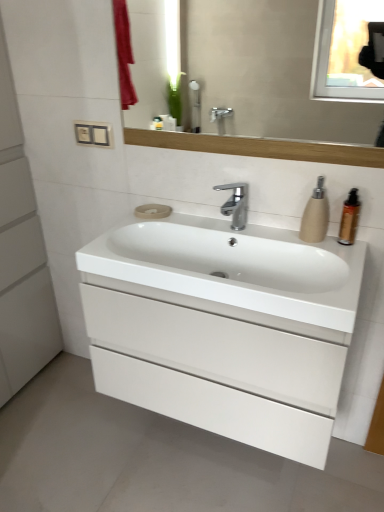
Where is `free space to the left of brown glossy bottle at right`? The height and width of the screenshot is (512, 384). free space to the left of brown glossy bottle at right is located at coordinates (311, 239).